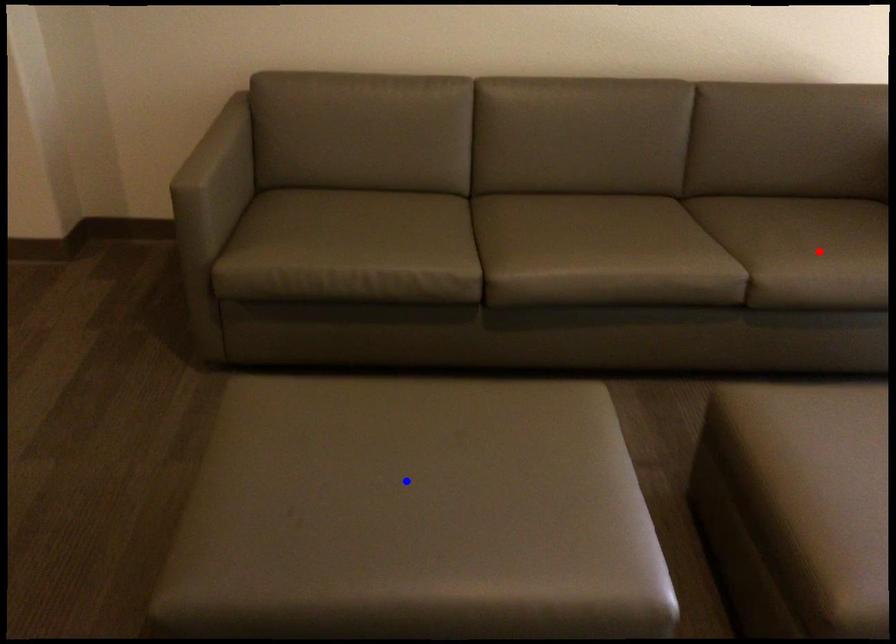
Question: Which of the two points in the image is closer to the camera?

Choices:
 (A) Blue point is closer.
 (B) Red point is closer.

Answer: (A)